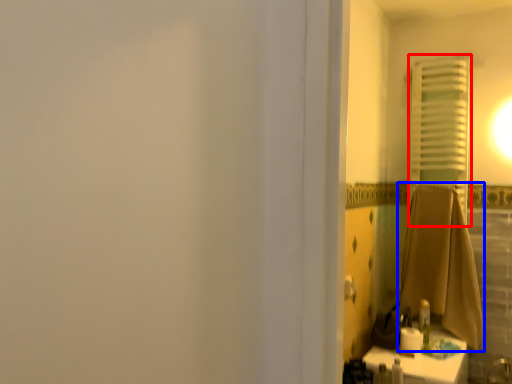
Question: Which object appears farthest to the camera in this image, curtain (highlighted by a red box) or bath towel (highlighted by a blue box)?

Choices:
 (A) curtain
 (B) bath towel

Answer: (A)